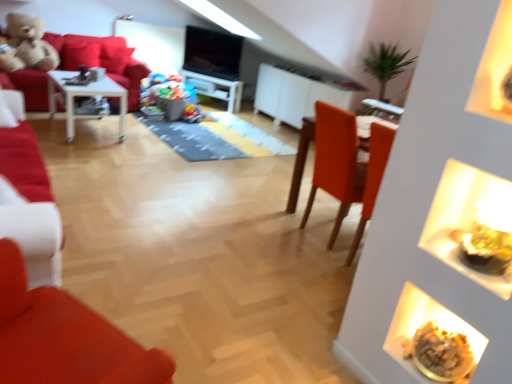
Question: In terms of height, does velvet plush teddy bear at upper left look taller or shorter compared to white glossy entertainment center at center?

Choices:
 (A) tall
 (B) short

Answer: (A)

Question: Is velvet plush teddy bear at upper left spatially inside white glossy entertainment center at center, or outside of it?

Choices:
 (A) outside
 (B) inside

Answer: (A)

Question: Estimate the real-world distances between objects in this image. Which object is closer to the fluffy beige teddy bear at upper left?

Choices:
 (A) matte white chair at left
 (B) matte orange table at center, which appears as the second table when viewed from the top
 (C) white glossy entertainment center at center
 (D) smooth plastic toy at center, marked as the 2th food in a bottom-to-top arrangement
 (E) velvet plush teddy bear at upper left

Answer: (E)

Question: Which is nearer to the velvet plush teddy bear at upper left?

Choices:
 (A) white glossy table at left, the first table from the back
 (B) white glossy entertainment center at center
 (C) fluffy beige teddy bear at upper left
 (D) matte white chair at left
 (E) matte orange table at center, the first table positioned from the bottom

Answer: (C)